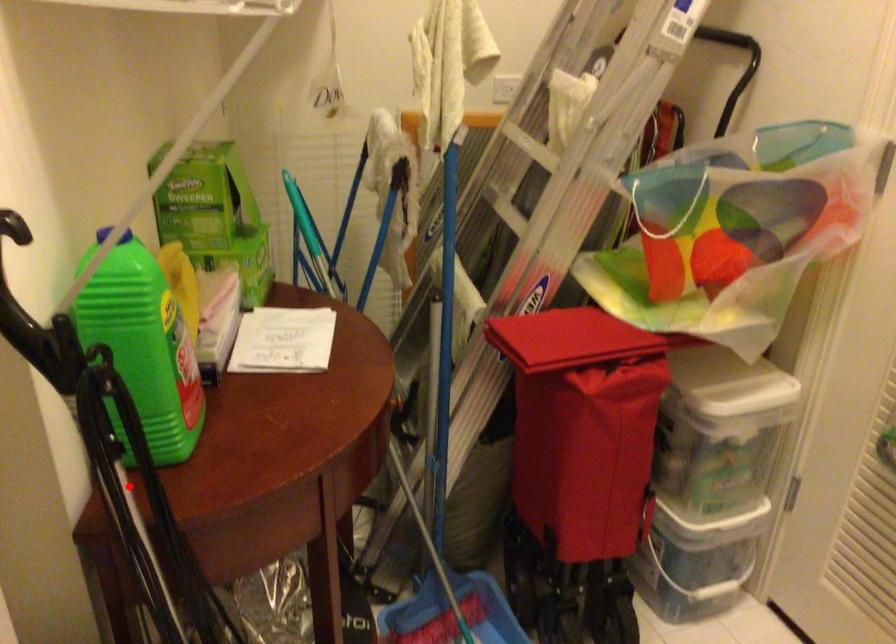
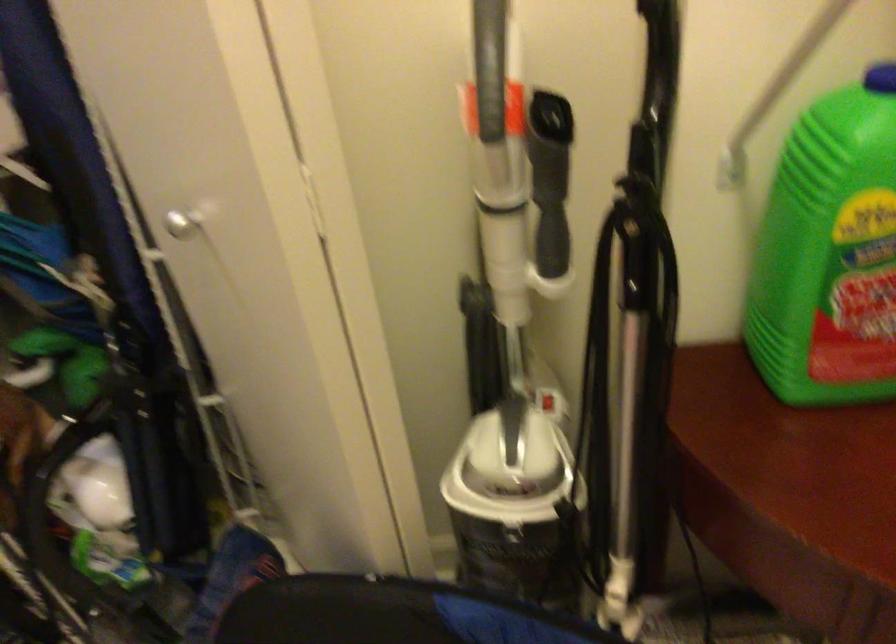
In the second image, find the point that corresponds to the highlighted location in the first image.

(633, 348)